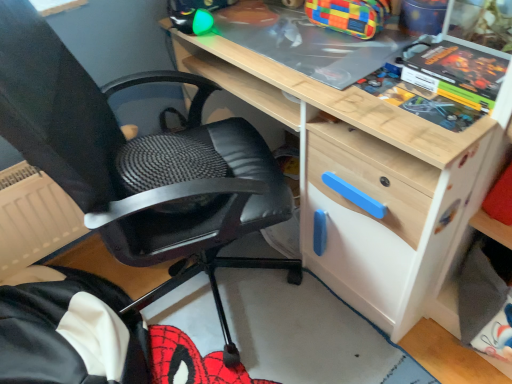
At what (x,y) coordinates should I click in order to perform the action: click on blank area beneath black leather chair at center (from a real-world perspective). Please return your answer as a coordinate pair (x, y). The height and width of the screenshot is (384, 512). Looking at the image, I should click on 214,298.